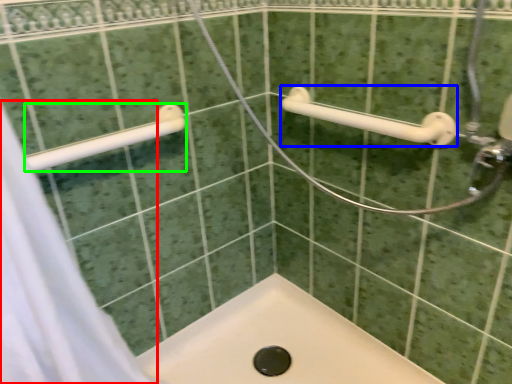
Question: Considering the real-world distances, which object is closest to shower curtain (highlighted by a red box)? towel rack (highlighted by a blue box) or towel rack (highlighted by a green box).

Choices:
 (A) towel rack
 (B) towel rack

Answer: (B)